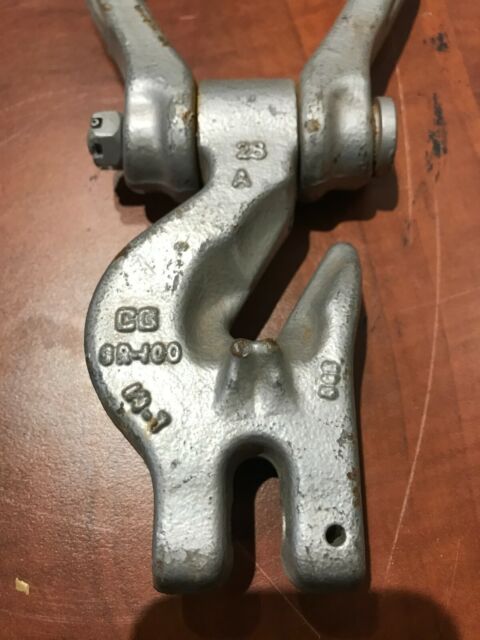
Image resolution: width=480 pixels, height=640 pixels. Find the location of `wood countertop`. wood countertop is located at coordinates (59, 475).